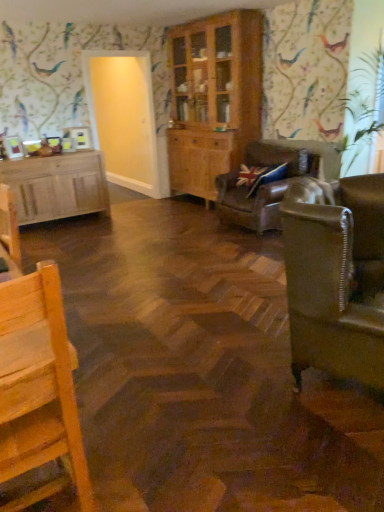
Question: Considering the positions of wooden cabinet at center, which is the 2th cabinetry from left to right, and wooden chair at lower left in the image, is wooden cabinet at center, which is the 2th cabinetry from left to right, wider or thinner than wooden chair at lower left?

Choices:
 (A) thin
 (B) wide

Answer: (A)

Question: From a real-world perspective, relative to wooden chair at lower left, is wooden cabinet at center, which is the 2th cabinetry from left to right, vertically above or below?

Choices:
 (A) below
 (B) above

Answer: (B)

Question: Which object is positioned closest to the wooden cabinet at center, arranged as the 1th cabinetry when viewed from the right?

Choices:
 (A) light wood cabinet at left, arranged as the first cabinetry when viewed from the left
 (B) leather couch at right, which is the 1th studio couch from front to back
 (C) wooden chair at lower left
 (D) leather sofa at center, which is counted as the second studio couch, starting from the front
 (E) transparent glass door at upper left

Answer: (E)

Question: Considering the real-world distances, which object is closest to the wooden chair at lower left?

Choices:
 (A) light wood cabinet at left, arranged as the first cabinetry when viewed from the left
 (B) wooden cabinet at center, arranged as the 1th cabinetry when viewed from the right
 (C) leather sofa at center, which is counted as the second studio couch, starting from the front
 (D) transparent glass door at upper left
 (E) leather couch at right, which is the 1th studio couch from front to back

Answer: (E)